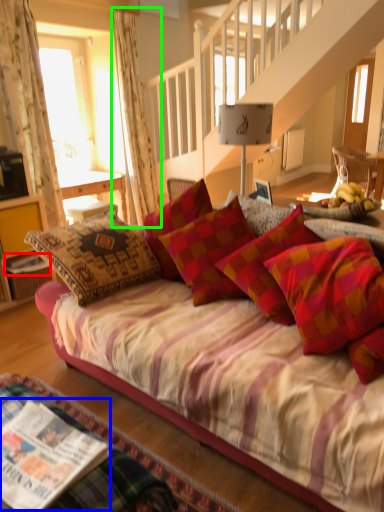
Question: Considering the real-world distances, which object is closest to magazine (highlighted by a red box)? magazine (highlighted by a blue box) or curtain (highlighted by a green box).

Choices:
 (A) magazine
 (B) curtain

Answer: (B)